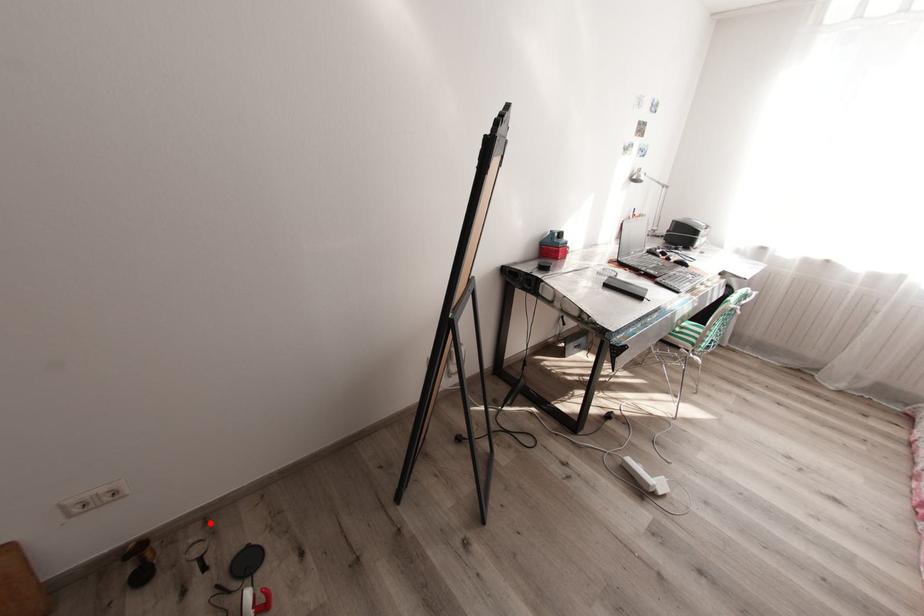
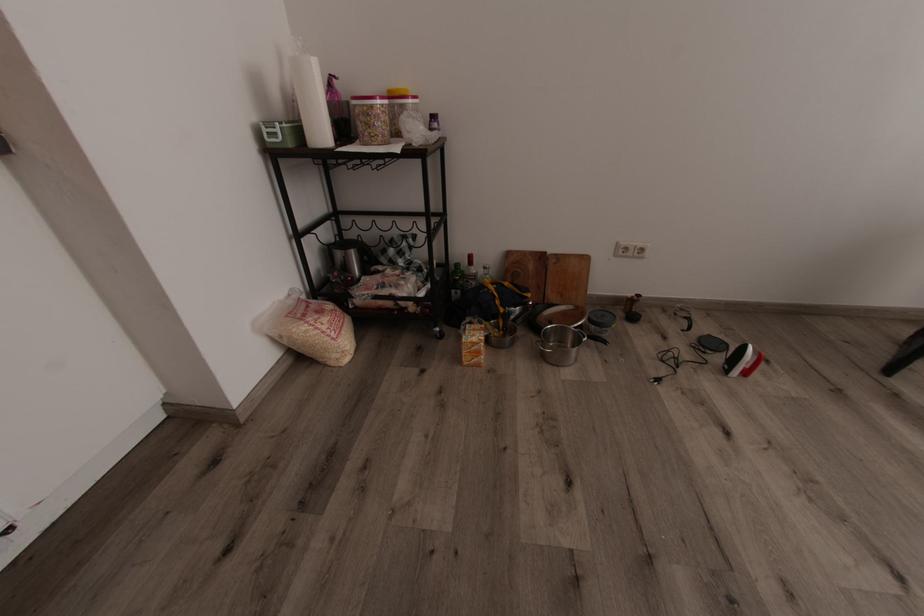
Locate, in the second image, the point that corresponds to the highlighted location in the first image.

(669, 310)